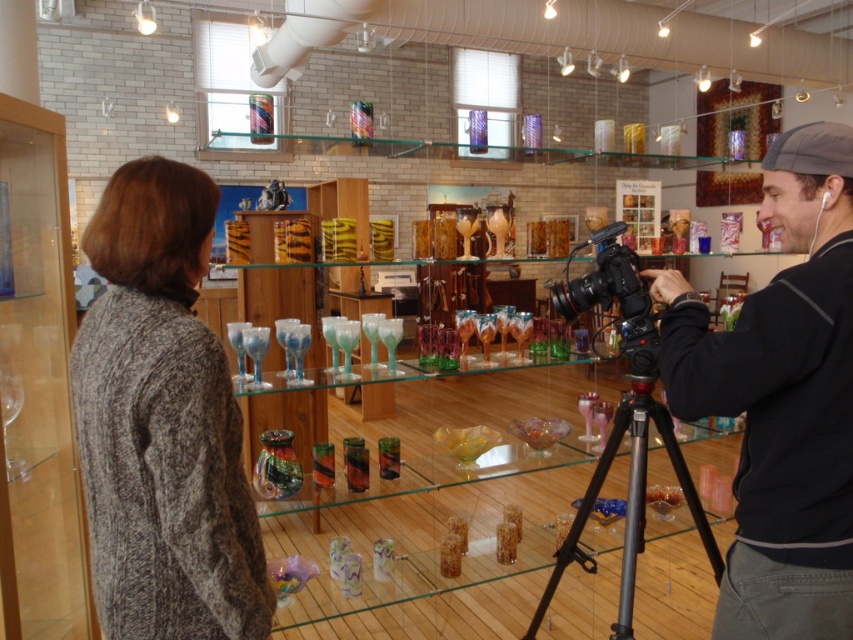
You are a photographer trying to set up your equipment in the glassware shop. You have a black matte camera at center and a black metal tripod at center. If the minimum distance required between the camera and tripod for proper setup is 20 inches, will your setup meet the requirement?

The black matte camera at center and black metal tripod at center are 19.59 inches apart from each other, which is less than the required 20 inches. Therefore, the setup does not meet the requirement.

Consider the image. You are standing at the point marked as point (242, 582) in the scene. The camera is set up to capture images at a maximum distance of 4 feet. Can you confirm if the camera can capture your current position?

The distance of point (242, 582) from the camera is exactly 4.02 feet, which exceeds the camera maximum distance of 4 feet. Therefore, the camera cannot capture your current position.

You are setting up a camera in the glassware shop. You have a black metal tripod at center and a black plastic video camera at center. Where should you place the camera to ensure it is properly mounted on the tripod?

The black metal tripod at center is to the right of the black plastic video camera at center, so you should place the black plastic video camera at center to the left of the black metal tripod at center to ensure proper mounting.